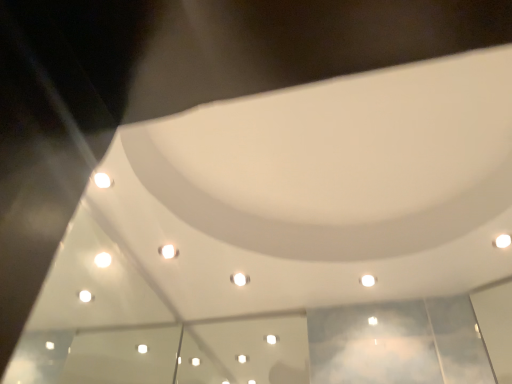
In order to click on white glossy light at upper right, the 1th light when ordered from right to left in this screenshot , I will do `click(503, 241)`.

Image resolution: width=512 pixels, height=384 pixels. I want to click on white glossy light at center, the third light when ordered from front to back, so click(x=239, y=279).

In the image, is white glossy light at upper center, which is counted as the 2th light, starting from the top, positioned in front of or behind white glossy light at upper right, the 3th light viewed from the left?

Clearly, white glossy light at upper center, which is counted as the 2th light, starting from the top, is behind white glossy light at upper right, the 3th light viewed from the left.

Can you confirm if white glossy light at upper center, which is the 2th light from back to front, is shorter than white glossy light at upper right, the third light positioned from the bottom?

Yes, white glossy light at upper center, which is the 2th light from back to front, is shorter than white glossy light at upper right, the third light positioned from the bottom.

Which of these two, white glossy light at upper center, which is counted as the 2th light, starting from the top, or white glossy light at upper right, the third light positioned from the bottom, is thinner?

white glossy light at upper right, the third light positioned from the bottom, is thinner.

Does point (374, 280) come behind point (506, 238)?

That is True.

Between white glossy light at upper center, placed as the 2th light when sorted from front to back, and white glossy light at center, which ranks as the first light in back-to-front order, which one appears on the left side from the viewer's perspective?

white glossy light at center, which ranks as the first light in back-to-front order, is more to the left.

Is white glossy light at center, the first light viewed from the left, completely or partially inside white glossy light at upper center, arranged as the second light when viewed from the left?

No, white glossy light at upper center, arranged as the second light when viewed from the left, does not contain white glossy light at center, the first light viewed from the left.

Is white glossy light at upper center, placed as the 2th light when sorted from front to back, next to white glossy light at center, which ranks as the first light in back-to-front order, and touching it?

white glossy light at upper center, placed as the 2th light when sorted from front to back, and white glossy light at center, which ranks as the first light in back-to-front order, are clearly separated.

What's the angular difference between white glossy light at upper center, which is the 2th light from back to front, and white glossy light at center, the first light from the bottom,'s facing directions?

The facing directions of white glossy light at upper center, which is the 2th light from back to front, and white glossy light at center, the first light from the bottom, are 0.00142 degrees apart.

From the image's perspective, which object appears higher, white glossy light at upper right, the 1th light positioned from the top, or white glossy light at center, marked as the 3th light in a right-to-left arrangement?

white glossy light at upper right, the 1th light positioned from the top, is shown above in the image.

Is white glossy light at upper right, the 1th light positioned from the top, positioned behind white glossy light at center, the first light viewed from the left?

No, the depth of white glossy light at upper right, the 1th light positioned from the top, is less than that of white glossy light at center, the first light viewed from the left.

Between white glossy light at upper right, the 3th light viewed from the left, and white glossy light at center, the first light viewed from the left, which one has smaller width?

Thinner between the two is white glossy light at upper right, the 3th light viewed from the left.

I want to click on the 2nd light behind when counting from the white glossy light at upper right, the 1th light positioned from the top, so click(239, 279).

From the image's perspective, does white glossy light at center, marked as the 3th light in a right-to-left arrangement, appear lower than white glossy light at upper right, the 1th light positioned from the top?

Indeed, from the image's perspective, white glossy light at center, marked as the 3th light in a right-to-left arrangement, is shown beneath white glossy light at upper right, the 1th light positioned from the top.

How many degrees apart are the facing directions of white glossy light at center, the third light when ordered from front to back, and white glossy light at upper right, the 3th light viewed from the left?

They differ by 90 degrees in their facing directions.

Between white glossy light at center, the third light when ordered from front to back, and white glossy light at upper right, the 1th light positioned from the top, which one appears on the left side from the viewer's perspective?

white glossy light at center, the third light when ordered from front to back, is more to the left.

Which of these two, white glossy light at upper right, which appears as the 1th light when viewed from the front, or white glossy light at upper center, placed as the 2th light when sorted from front to back, is bigger?

Bigger between the two is white glossy light at upper right, which appears as the 1th light when viewed from the front.

From the image's perspective, is white glossy light at upper right, the 3th light viewed from the left, beneath white glossy light at upper center, arranged as the second light when viewed from the left?

No.

Find the location of a particular element. The height and width of the screenshot is (384, 512). light that is the 1st object located below the white glossy light at upper right, which appears as the 1th light when viewed from the front (from the image's perspective) is located at coordinates (368, 280).

Would you say white glossy light at upper right, the 1th light positioned from the top, contains white glossy light at upper center, which is the 2th light from back to front?

That's incorrect, white glossy light at upper center, which is the 2th light from back to front, is not inside white glossy light at upper right, the 1th light positioned from the top.

Which is less distant, (x=241, y=276) or (x=362, y=279)?

Positioned in front is point (x=362, y=279).

This screenshot has width=512, height=384. I want to click on light that is the 1st one when counting forward from the white glossy light at center, which ranks as the first light in back-to-front order, so click(368, 280).

Who is shorter, white glossy light at center, the third light when ordered from front to back, or white glossy light at upper center, which is the 2th light from back to front?

white glossy light at upper center, which is the 2th light from back to front.

Relative to white glossy light at upper center, acting as the 2th light starting from the right, is white glossy light at center, which ranks as the first light in back-to-front order, in front or behind?

Clearly, white glossy light at center, which ranks as the first light in back-to-front order, is behind white glossy light at upper center, acting as the 2th light starting from the right.

This screenshot has height=384, width=512. I want to click on light in front of the white glossy light at upper center, arranged as the second light when viewed from the left, so click(x=503, y=241).

Locate an element on the screen. The width and height of the screenshot is (512, 384). light that is the 1st object to the right of the white glossy light at center, marked as the 3th light in a right-to-left arrangement, starting at the anchor is located at coordinates (368, 280).

Looking at this image, based on their spatial positions, is white glossy light at upper right, the 1th light positioned from the top, or white glossy light at center, the first light viewed from the left, further from white glossy light at upper center, which is counted as the 2th light, starting from the top?

white glossy light at center, the first light viewed from the left, is further to white glossy light at upper center, which is counted as the 2th light, starting from the top.

Looking at this image, from the image, which object appears to be farther from white glossy light at center, which is the third light in top-to-bottom order, white glossy light at upper center, acting as the 2th light starting from the right, or white glossy light at upper right, which appears as the third light when viewed from the back?

white glossy light at upper right, which appears as the third light when viewed from the back, lies further to white glossy light at center, which is the third light in top-to-bottom order, than the other object.

Which object lies further to the anchor point white glossy light at upper center, placed as the second light when sorted from bottom to top, white glossy light at center, the first light from the bottom, or white glossy light at upper right, the 1th light positioned from the top?

white glossy light at center, the first light from the bottom, lies further to white glossy light at upper center, placed as the second light when sorted from bottom to top, than the other object.

Which object lies further to the anchor point white glossy light at upper right, the 1th light positioned from the top, white glossy light at upper center, acting as the 2th light starting from the right, or white glossy light at center, marked as the 3th light in a right-to-left arrangement?

Among the two, white glossy light at center, marked as the 3th light in a right-to-left arrangement, is located further to white glossy light at upper right, the 1th light positioned from the top.

From the image, which object appears to be nearer to white glossy light at upper right, which appears as the third light when viewed from the back, white glossy light at center, the third light when ordered from front to back, or white glossy light at upper center, arranged as the second light when viewed from the left?

white glossy light at upper center, arranged as the second light when viewed from the left, is positioned closer to the anchor white glossy light at upper right, which appears as the third light when viewed from the back.

Looking at the image, which one is located further to white glossy light at center, marked as the 3th light in a right-to-left arrangement, white glossy light at upper right, the 1th light positioned from the top, or white glossy light at upper center, which is counted as the 2th light, starting from the top?

Among the two, white glossy light at upper right, the 1th light positioned from the top, is located further to white glossy light at center, marked as the 3th light in a right-to-left arrangement.

The image size is (512, 384). I want to click on light between white glossy light at center, which is the third light in top-to-bottom order, and white glossy light at upper right, the 1th light positioned from the top, in the horizontal direction, so click(x=368, y=280).